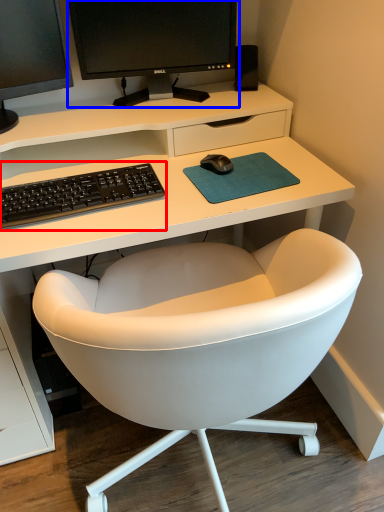
Question: Which object is further to the camera taking this photo, computer keyboard (highlighted by a red box) or computer monitor (highlighted by a blue box)?

Choices:
 (A) computer keyboard
 (B) computer monitor

Answer: (B)